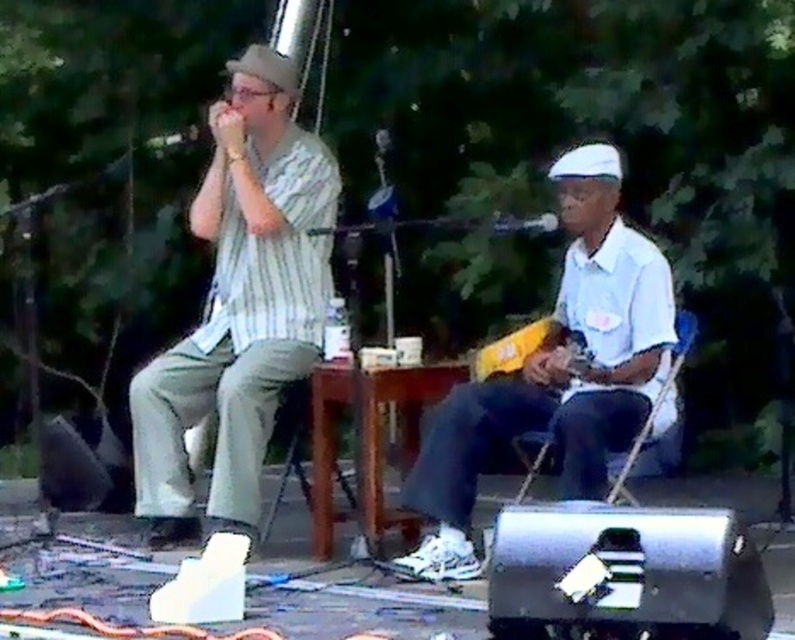
You are a stagehand who needs to place a 1.2 meter wide banner between the striped cotton shirt at center and the white matte shirt at center. Is there enough space to fit the banner between them?

The distance between the striped cotton shirt at center and the white matte shirt at center is 1.19 meters. Since the banner is 1.2 meters wide, it would not fit as the space is slightly narrower than the banner.

You are a photographer setting up for a live outdoor music session. You need to position your camera to capture both the striped cotton shirt at center and the white matte shirt at center clearly. Based on their positions, which shirt should you focus on first to ensure both are in frame?

The striped cotton shirt at center is located above the white matte shirt at center, so you should focus on the white matte shirt at center first to ensure both are in frame.